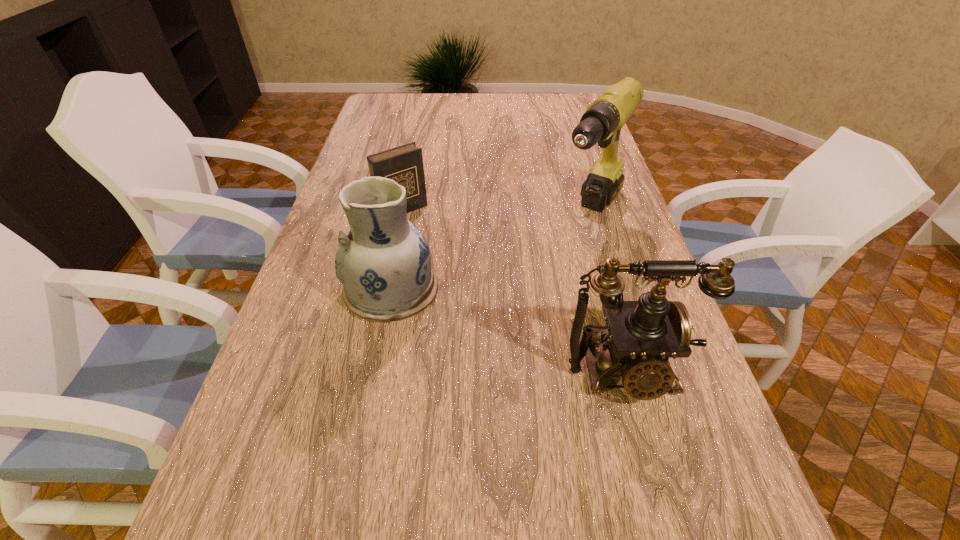
I want to click on vacant space located 0.300m on the front cover of the shortest object, so click(469, 279).

Locate an element on the screen. Image resolution: width=960 pixels, height=540 pixels. vacant space situated on the front cover of the shortest object is located at coordinates (444, 251).

The image size is (960, 540). I want to click on pottery that is positioned at the left edge, so click(383, 261).

Find the location of a particular element. The width and height of the screenshot is (960, 540). diary located at the left edge is located at coordinates (404, 164).

Identify the location of telephone that is at the right edge. The width and height of the screenshot is (960, 540). (642, 335).

The width and height of the screenshot is (960, 540). Find the location of `drill at the right edge`. drill at the right edge is located at coordinates (602, 122).

In the image, there is a desktop. At what (x,y) coordinates should I click in order to perform the action: click on vacant space at the far edge. Please return your answer as a coordinate pair (x, y). The image size is (960, 540). Looking at the image, I should click on (489, 104).

Image resolution: width=960 pixels, height=540 pixels. In the image, there is a desktop. In order to click on vacant space at the near edge in this screenshot , I will do `click(616, 474)`.

This screenshot has width=960, height=540. Identify the location of vacant space at the left edge of the desktop. (362, 167).

Identify the location of free space at the right edge of the desktop. This screenshot has width=960, height=540. (638, 242).